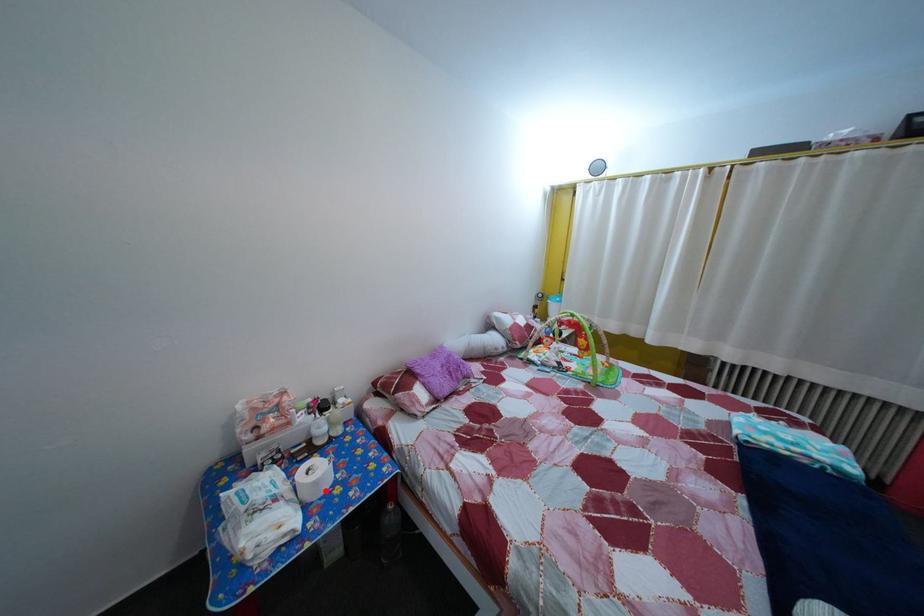
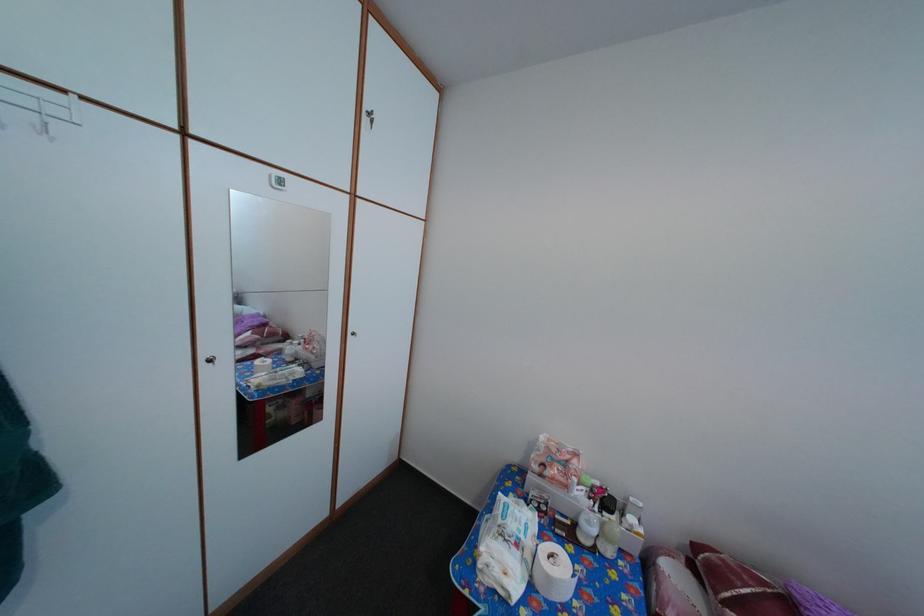
Question: I am providing you with two images of the same scene from different viewpoints. A red point is marked on the first image. Can you still see the location of the red point in image 2?

Choices:
 (A) Yes
 (B) No

Answer: (A)